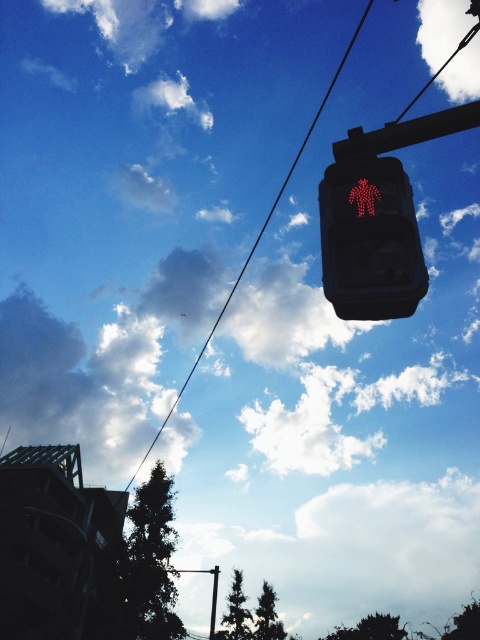
Who is taller, metallic pole at center or metallic pole at upper center?

With more height is metallic pole at center.

Who is positioned more to the left, metallic pole at center or metallic pole at upper center?

metallic pole at center is more to the left.

Is point (210, 636) in front of point (211, 609)?

Yes, point (210, 636) is in front of point (211, 609).

Find the location of a particular element. metallic pole at center is located at coordinates (212, 589).

Does red led pedestrian at upper center have a lesser height compared to metallic pole at center?

Correct, red led pedestrian at upper center is not as tall as metallic pole at center.

Measure the distance between point [320,182] and camera.

6.14 meters

Where is `red led pedestrian at upper center`? This screenshot has height=640, width=480. red led pedestrian at upper center is located at coordinates (370, 241).

Can you confirm if red led pedestrian at upper center is thinner than black wire at upper center?

Indeed, red led pedestrian at upper center has a lesser width compared to black wire at upper center.

Does red led pedestrian at upper center appear on the left side of black wire at upper center?

In fact, red led pedestrian at upper center is to the right of black wire at upper center.

This screenshot has width=480, height=640. What do you see at coordinates (370, 241) in the screenshot?
I see `red led pedestrian at upper center` at bounding box center [370, 241].

I want to click on red led pedestrian at upper center, so click(370, 241).